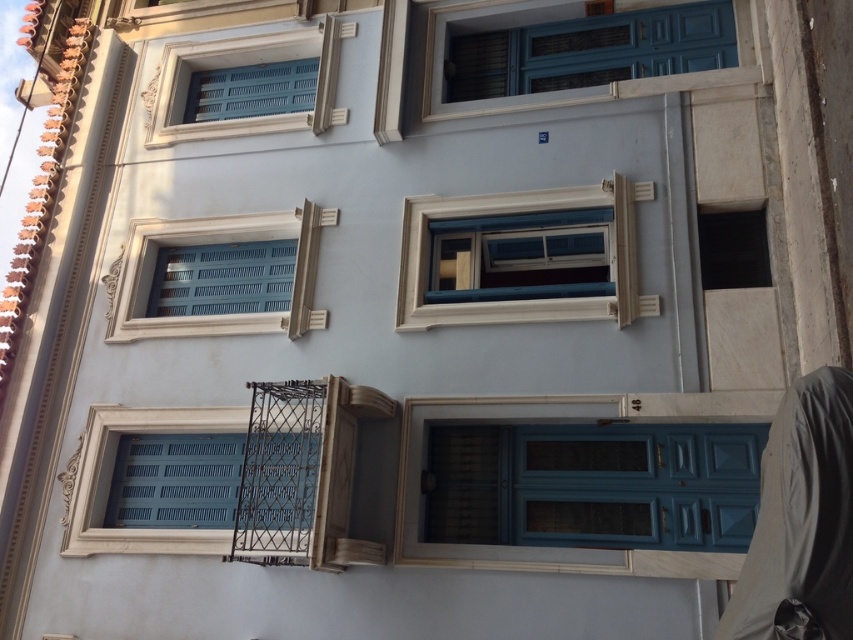
Who is higher up, white painted wood window at upper left or matte blue shutters at upper left?

Positioned higher is matte blue shutters at upper left.

Describe the element at coordinates (241, 68) in the screenshot. I see `white painted wood window at upper left` at that location.

What are the coordinates of `white painted wood window at upper left` in the screenshot? It's located at (241, 68).

Based on the photo, does matte blue door at upper center appear on the left side of white painted wood window at upper left?

No, matte blue door at upper center is not to the left of white painted wood window at upper left.

Is matte blue door at upper center to the right of white painted wood window at upper left from the viewer's perspective?

Indeed, matte blue door at upper center is positioned on the right side of white painted wood window at upper left.

Does point (593, 28) come farther from viewer compared to point (166, 132)?

No, it is in front of (166, 132).

Find the location of `matte blue door at upper center`. matte blue door at upper center is located at coordinates (572, 54).

Is matte blue shutter at center above white painted wood window at upper left?

No.

Is matte blue shutter at center positioned behind white painted wood window at upper left?

That is False.

Is point (112, 524) positioned before point (338, 32)?

Yes.

What are the coordinates of `matte blue shutter at center` in the screenshot? It's located at 213,481.